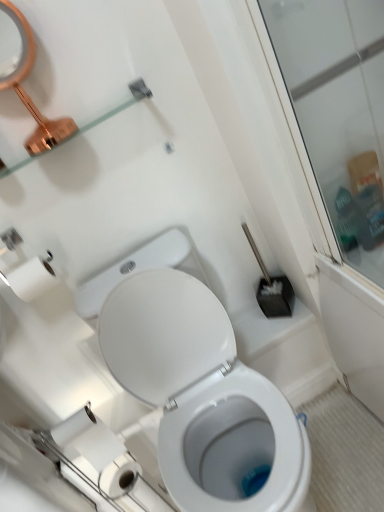
Question: Could you tell me if white paper at lower left is turned towards copper metallic mirror at upper left?

Choices:
 (A) no
 (B) yes

Answer: (A)

Question: Does white paper at lower left have a lesser width compared to copper metallic mirror at upper left?

Choices:
 (A) no
 (B) yes

Answer: (B)

Question: Is copper metallic mirror at upper left completely or partially inside white paper at lower left?

Choices:
 (A) no
 (B) yes

Answer: (A)

Question: Considering the relative positions of white paper at lower left and copper metallic mirror at upper left in the image provided, is white paper at lower left in front of copper metallic mirror at upper left?

Choices:
 (A) no
 (B) yes

Answer: (A)

Question: Considering the relative sizes of white paper at lower left and copper metallic mirror at upper left in the image provided, is white paper at lower left wider than copper metallic mirror at upper left?

Choices:
 (A) yes
 (B) no

Answer: (B)

Question: From a real-world perspective, does white paper at lower left sit lower than copper metallic mirror at upper left?

Choices:
 (A) yes
 (B) no

Answer: (A)

Question: Is clear glass shelf at upper left positioned before white glossy toilet at center?

Choices:
 (A) yes
 (B) no

Answer: (B)

Question: Does clear glass shelf at upper left have a smaller size compared to white glossy toilet at center?

Choices:
 (A) no
 (B) yes

Answer: (B)

Question: Is clear glass shelf at upper left at the left side of white glossy toilet at center?

Choices:
 (A) yes
 (B) no

Answer: (A)

Question: Is clear glass shelf at upper left with white glossy toilet at center?

Choices:
 (A) yes
 (B) no

Answer: (B)

Question: Is clear glass shelf at upper left at the right side of white glossy toilet at center?

Choices:
 (A) yes
 (B) no

Answer: (B)

Question: Considering the relative sizes of clear glass shelf at upper left and white glossy toilet at center in the image provided, is clear glass shelf at upper left shorter than white glossy toilet at center?

Choices:
 (A) no
 (B) yes

Answer: (B)

Question: Is white glossy bidet at lower center far away from clear glass shelf at upper left?

Choices:
 (A) yes
 (B) no

Answer: (B)